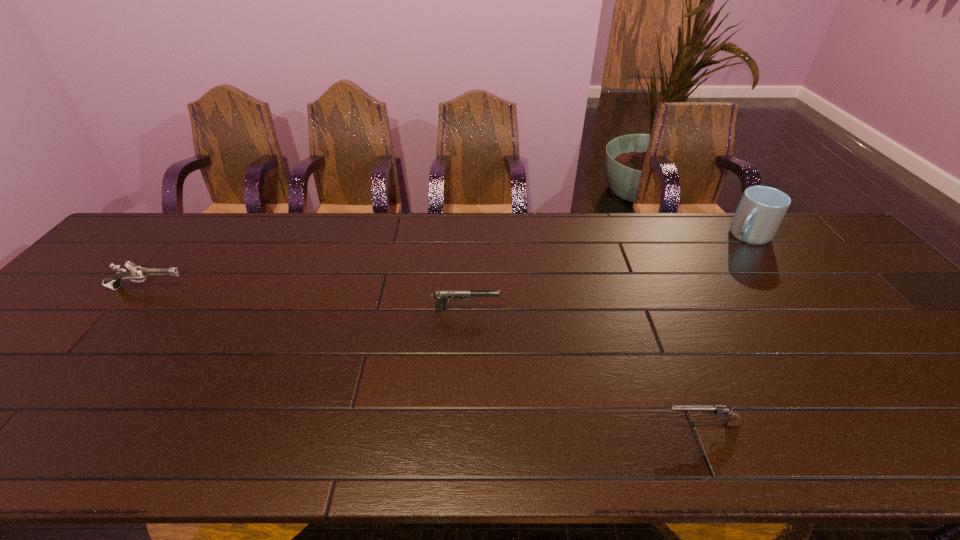
Where is `the rightmost object`? The height and width of the screenshot is (540, 960). the rightmost object is located at coordinates (761, 209).

The width and height of the screenshot is (960, 540). In order to click on mug in this screenshot , I will do click(761, 209).

You are a GUI agent. You are given a task and a screenshot of the screen. Output one action in this format:
    pyautogui.click(x=<x>, y=<y>)
    Task: Click on the leftmost gun
    Image resolution: width=960 pixels, height=540 pixels.
    Given the screenshot: What is the action you would take?
    pyautogui.click(x=133, y=272)

Locate an element on the screen. This screenshot has height=540, width=960. the second tallest object is located at coordinates (133, 272).

The height and width of the screenshot is (540, 960). I want to click on the second gun from left to right, so click(442, 296).

Identify the location of the third farthest object. (442, 296).

Locate an element on the screen. the second object from right to left is located at coordinates (734, 421).

This screenshot has width=960, height=540. Identify the location of the rightmost gun. (734, 421).

Locate an element on the screen. vacant area located on the left of the mug is located at coordinates (624, 235).

Identify the location of free space located aimed along the barrel of the farthest gun. Image resolution: width=960 pixels, height=540 pixels. (254, 288).